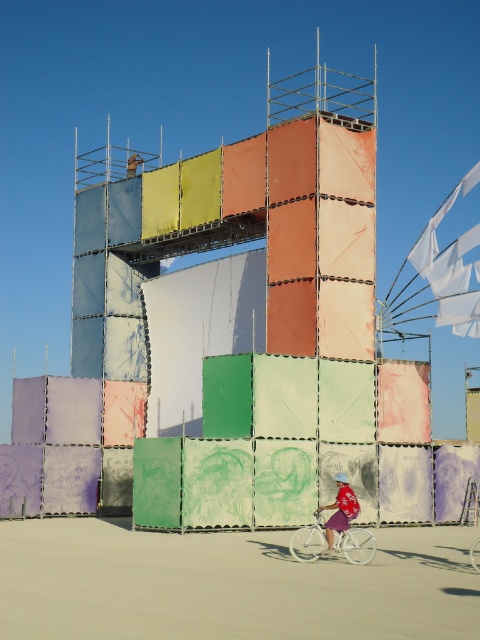
You are standing at the camera position looking at the art installation. There is a point marked at coordinates point (x=346, y=481). Can you reach this point by walking forward from your current position?

The point (x=346, y=481) is 40.81 meters away from the camera, so yes, you can reach it by walking forward since it is within the visible area.